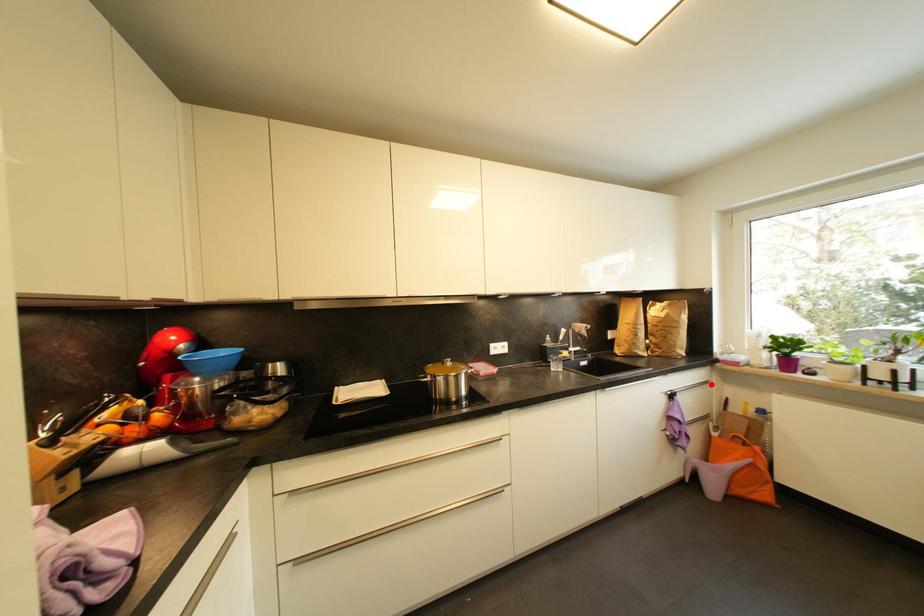
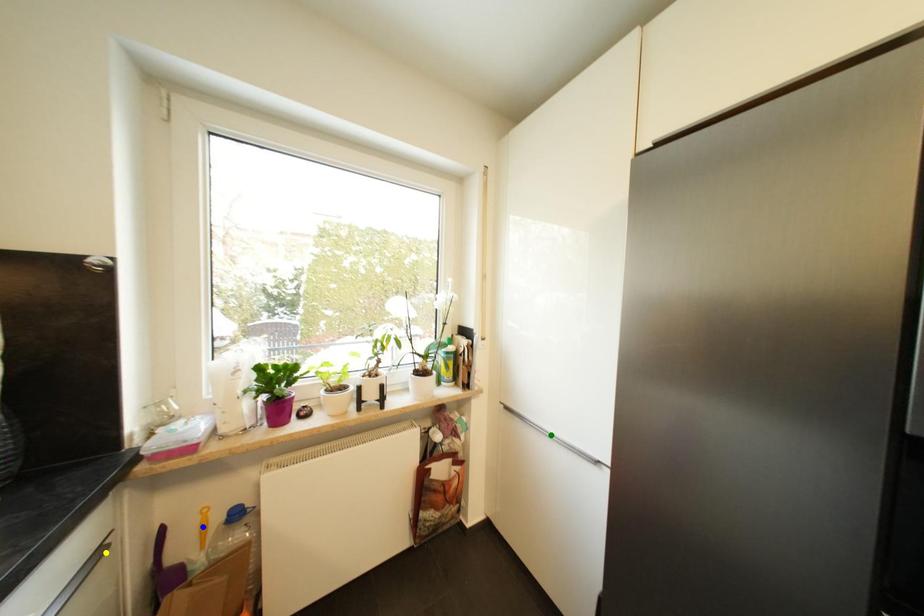
Question: I am providing you with two images of the same scene from different viewpoints. A red point is marked on the first image. You are given multiple points on the second image. Which point in image 2 is actually the same real-world point as the red point in image 1?

Choices:
 (A) blue point
 (B) green point
 (C) yellow point

Answer: (C)